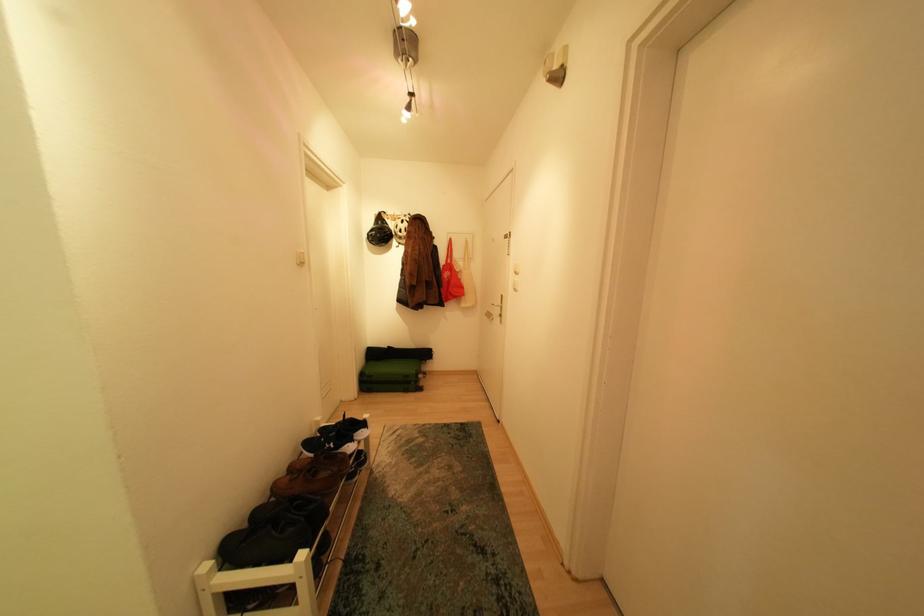
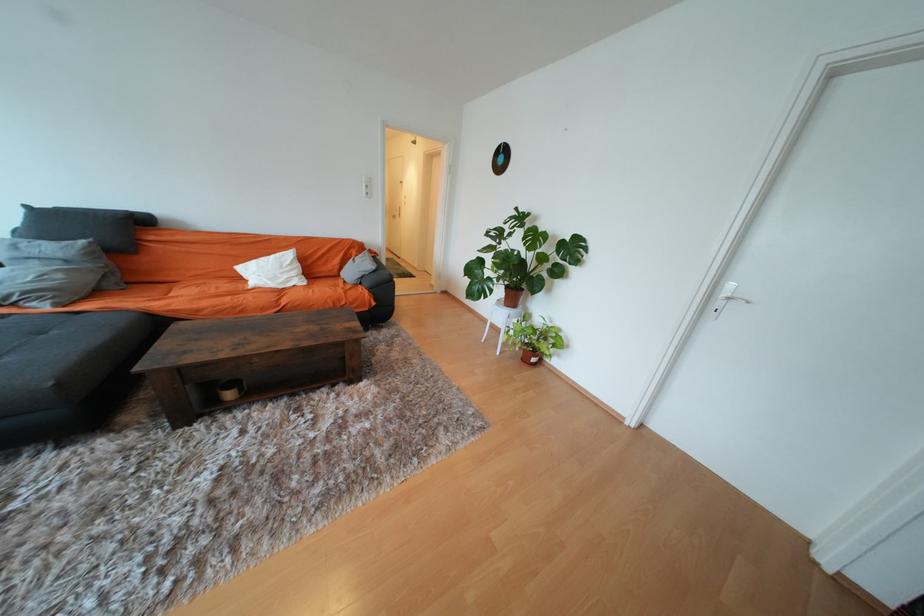
Question: What movement of the cameraman would produce the second image?

Choices:
 (A) Left
 (B) Right
 (C) Forward
 (D) Backward

Answer: (D)